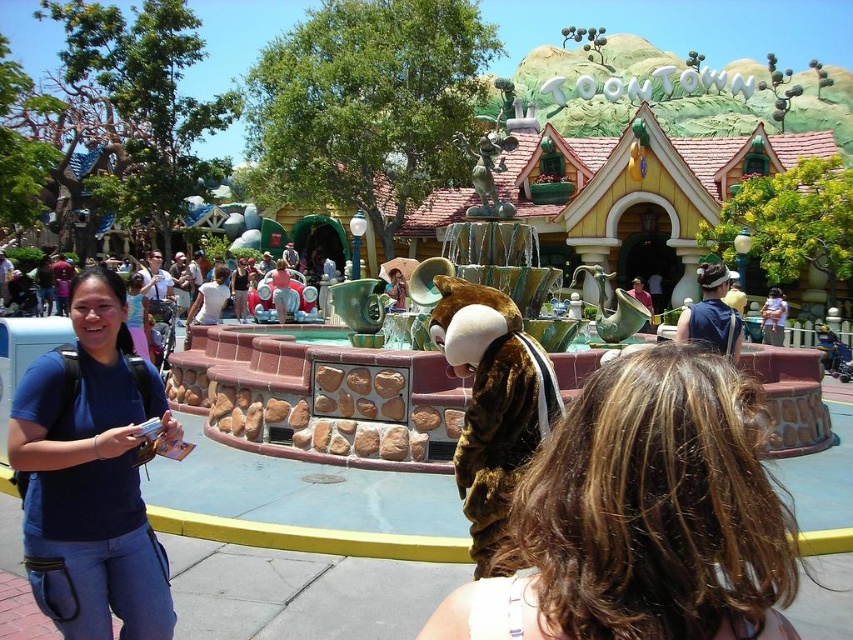
Where is `brown hair at center`? This screenshot has height=640, width=853. brown hair at center is located at coordinates (643, 516).

Is brown hair at center positioned in front of blue fabric shirt at center?

Yes, it is in front of blue fabric shirt at center.

Does point (514, 552) lie in front of point (97, 480)?

That is True.

Where is `brown hair at center`? The image size is (853, 640). brown hair at center is located at coordinates (643, 516).